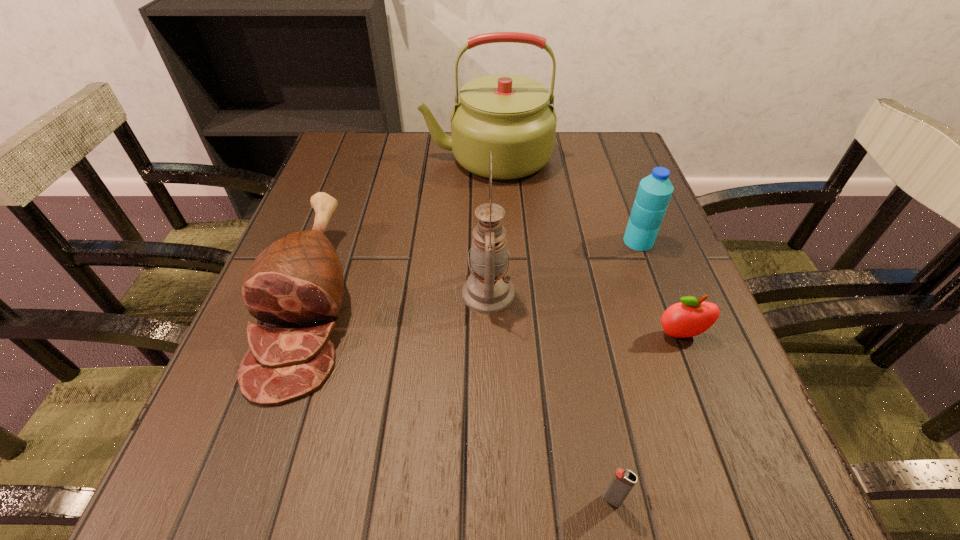
Where is `kettle`? The width and height of the screenshot is (960, 540). kettle is located at coordinates (510, 115).

Locate an element on the screen. oil lamp is located at coordinates (488, 290).

Find the location of `the fourth shortest object`. the fourth shortest object is located at coordinates (654, 192).

At what (x,y) coordinates should I click in order to perform the action: click on the third shortest object. Please return your answer as a coordinate pair (x, y). This screenshot has width=960, height=540. Looking at the image, I should click on (298, 281).

Where is `the leftmost object`? This screenshot has height=540, width=960. the leftmost object is located at coordinates (298, 281).

Locate an element on the screen. The height and width of the screenshot is (540, 960). the fifth tallest object is located at coordinates (690, 317).

Where is `the shortest object`? The width and height of the screenshot is (960, 540). the shortest object is located at coordinates (623, 481).

The width and height of the screenshot is (960, 540). I want to click on igniter, so click(623, 481).

Find the location of a particular element. The width and height of the screenshot is (960, 540). free space located 0.050m at the spout of the farthest object is located at coordinates (402, 157).

Locate an element on the screen. free location located at the spout of the farthest object is located at coordinates (372, 157).